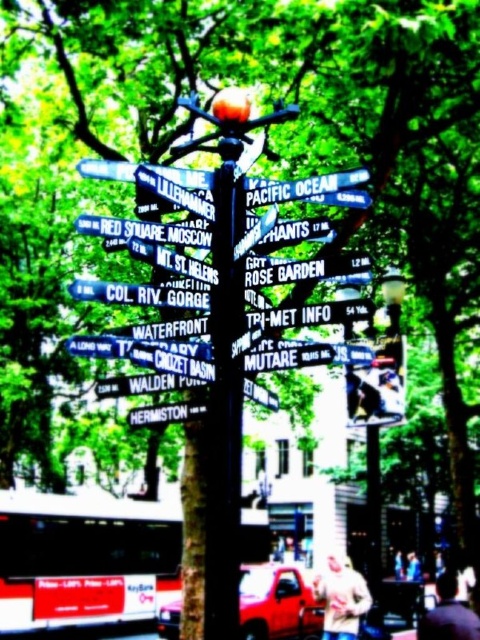
Is light beige sweater at lower center positioned at the back of green matte street sign at center?

That is True.

Is light beige sweater at lower center to the left of green matte street sign at center from the viewer's perspective?

Incorrect, light beige sweater at lower center is not on the left side of green matte street sign at center.

Between point (336, 586) and point (154, 417), which one is positioned in front?

Positioned in front is point (154, 417).

This screenshot has width=480, height=640. I want to click on light beige sweater at lower center, so click(340, 598).

Does point (149, 182) come behind point (144, 420)?

No, it is in front of (144, 420).

Image resolution: width=480 pixels, height=640 pixels. I want to click on metallic silver signpost at center, so point(168,196).

Who is lower down, black plastic street signs at center or metallic silver signpost at center?

Positioned lower is black plastic street signs at center.

Does black plastic street signs at center appear on the right side of metallic silver signpost at center?

Incorrect, black plastic street signs at center is not on the right side of metallic silver signpost at center.

Describe the element at coordinates (247, 278) in the screenshot. I see `black plastic street signs at center` at that location.

The height and width of the screenshot is (640, 480). I want to click on black plastic street signs at center, so click(247, 278).